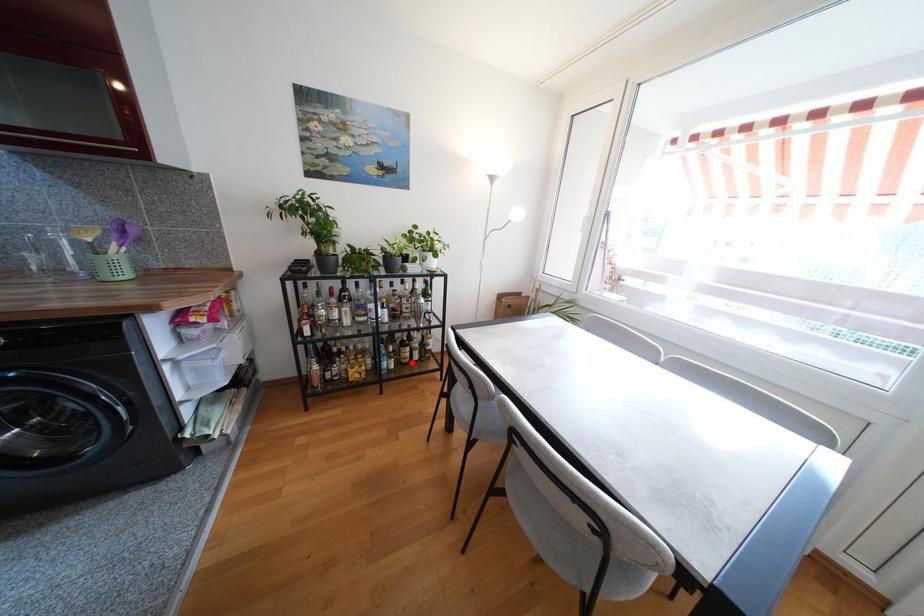
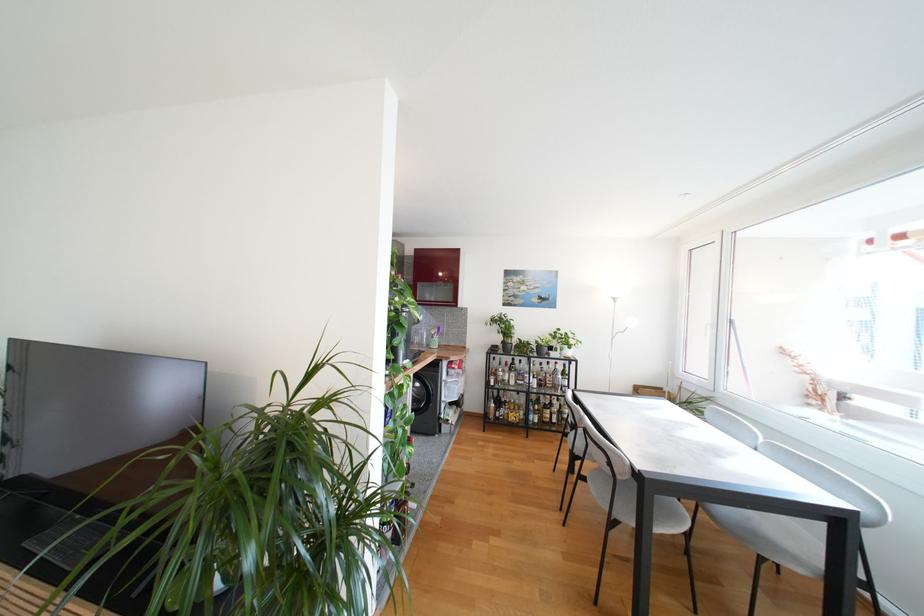
Question: A red point is marked in image1. In image2, is the corresponding 3D point closer to the camera or farther? Reply with the corresponding letter.

Choices:
 (A) The corresponding 3D point is closer.
 (B) The corresponding 3D point is farther.

Answer: (B)